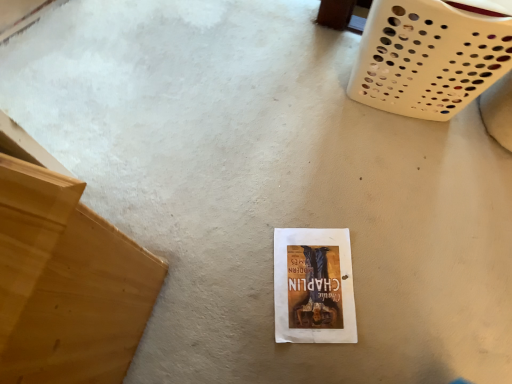
I want to click on vacant area that lies in front of white paper at center, so click(x=304, y=357).